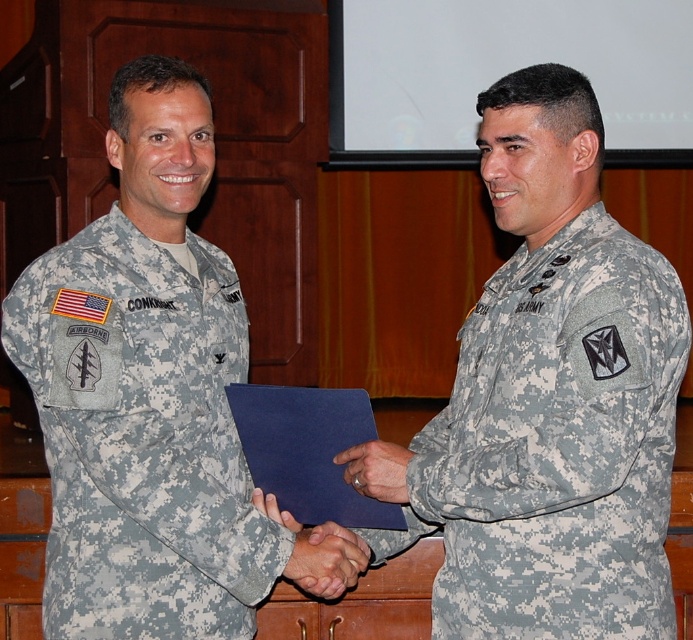
Question: Which object appears closest to the camera in this image?

Choices:
 (A) camouflage uniform at center
 (B) camouflage fabric uniform at left

Answer: (A)

Question: Which point is farther from the camera taking this photo?

Choices:
 (A) (674, 339)
 (B) (150, 460)

Answer: (A)

Question: Which of the following is the closest to the observer?

Choices:
 (A) camouflage uniform at center
 (B) camouflage fabric uniform at left

Answer: (A)

Question: Is camouflage uniform at center above camouflage fabric uniform at left?

Choices:
 (A) yes
 (B) no

Answer: (A)

Question: Does camouflage uniform at center come in front of camouflage fabric uniform at left?

Choices:
 (A) yes
 (B) no

Answer: (A)

Question: Can you confirm if camouflage uniform at center is positioned to the left of camouflage fabric uniform at left?

Choices:
 (A) no
 (B) yes

Answer: (A)